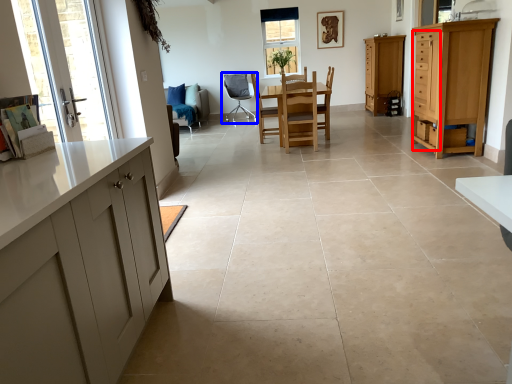
Question: Which object appears closest to the camera in this image, drawer (highlighted by a red box) or chair (highlighted by a blue box)?

Choices:
 (A) drawer
 (B) chair

Answer: (A)